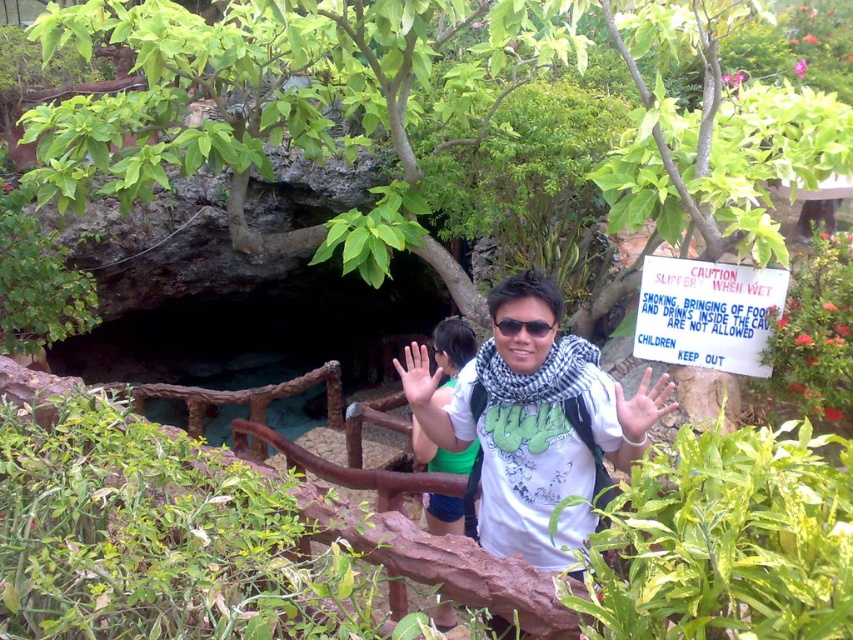
Question: Can you confirm if white paper sign at center right is thinner than white matte hand at center?

Choices:
 (A) no
 (B) yes

Answer: (A)

Question: Considering the relative positions of white cotton shirt at center and smooth skin hand at center in the image provided, where is white cotton shirt at center located with respect to smooth skin hand at center?

Choices:
 (A) left
 (B) right

Answer: (B)

Question: Which object is closer to the camera taking this photo?

Choices:
 (A) white matte hand at center
 (B) smooth skin hand at center
 (C) white paper sign at center right
 (D) white cotton shirt at center

Answer: (D)

Question: Among these points, which one is farthest from the camera?

Choices:
 (A) (544, 381)
 (B) (405, 360)

Answer: (B)

Question: Which point is farther to the camera?

Choices:
 (A) (412, 388)
 (B) (674, 340)
 (C) (436, 433)

Answer: (B)

Question: Can you confirm if white paper sign at center right is positioned to the right of smooth skin hand at center?

Choices:
 (A) no
 (B) yes

Answer: (B)